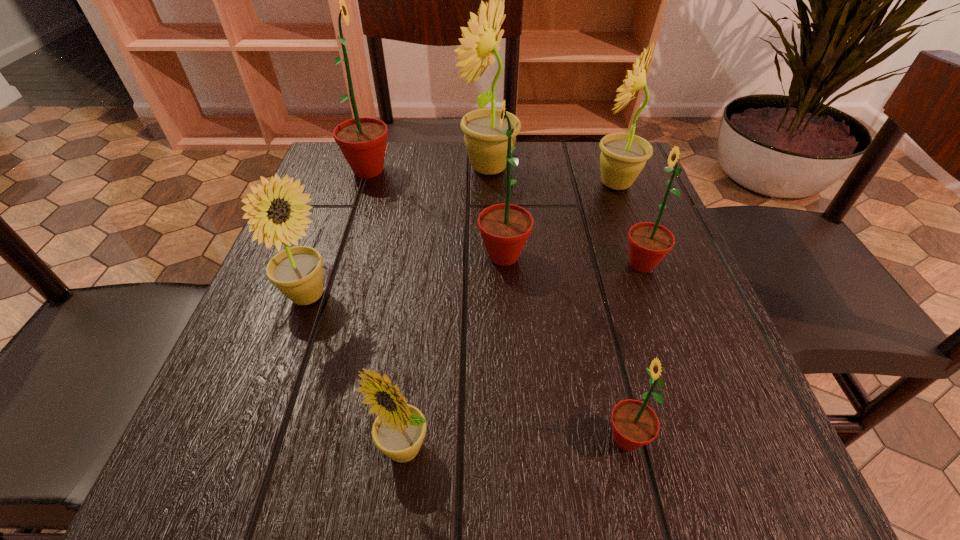
You are a GUI agent. You are given a task and a screenshot of the screen. Output one action in this format:
    pyautogui.click(x=<x>, y=<y>)
    Task: Click on the biggest yellow sunflower
    
    Given the screenshot: What is the action you would take?
    pyautogui.click(x=487, y=148)

Image resolution: width=960 pixels, height=540 pixels. Find the location of `the farthest green sunflower`. the farthest green sunflower is located at coordinates (362, 141).

Locate an element on the screen. This screenshot has width=960, height=540. the biggest green sunflower is located at coordinates (362, 141).

This screenshot has height=540, width=960. Find the location of `the third smallest yellow sunflower`. the third smallest yellow sunflower is located at coordinates (623, 156).

I want to click on the third green sunflower from right to left, so click(505, 228).

The width and height of the screenshot is (960, 540). Identify the location of the leftmost yellow sunflower. (297, 272).

Where is `the second smallest yellow sunflower`? Image resolution: width=960 pixels, height=540 pixels. the second smallest yellow sunflower is located at coordinates (297, 272).

Locate an element on the screen. This screenshot has height=540, width=960. the third biggest green sunflower is located at coordinates (649, 243).

Locate an element on the screen. This screenshot has width=960, height=540. the third sunflower from right to left is located at coordinates (634, 424).

You are a GUI agent. You are given a task and a screenshot of the screen. Output one action in this format:
    pyautogui.click(x=<x>, y=<y>)
    Task: Click on the sixth object from left to right
    Image resolution: width=960 pixels, height=540 pixels.
    Given the screenshot: What is the action you would take?
    pyautogui.click(x=634, y=424)